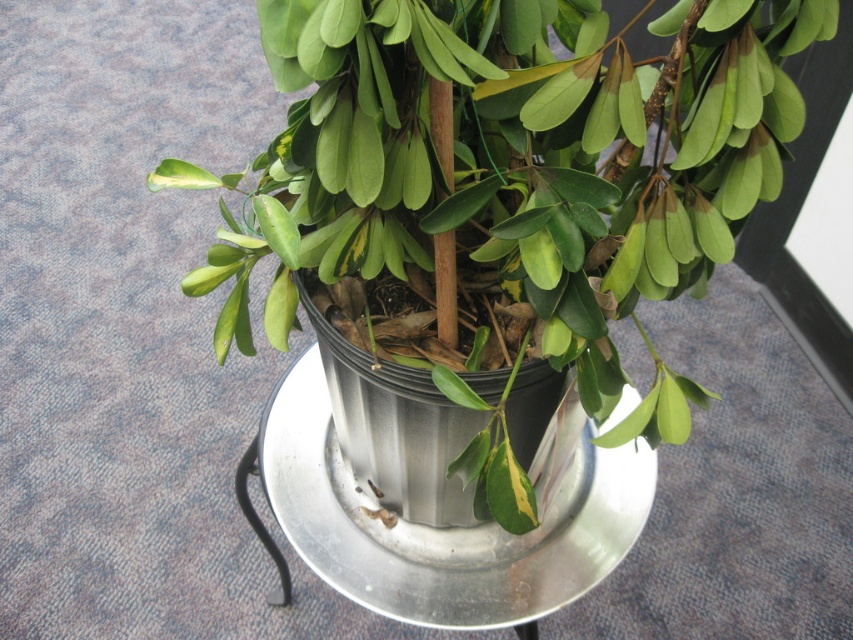
Who is positioned more to the left, green matte plant at center or green matte leaf at center?

From the viewer's perspective, green matte leaf at center appears more on the left side.

Measure the distance from green matte plant at center to green matte leaf at center.

green matte plant at center and green matte leaf at center are 8.77 inches apart.

This screenshot has height=640, width=853. Find the location of `green matte plant at center`. green matte plant at center is located at coordinates (498, 196).

Locate an element on the screen. The height and width of the screenshot is (640, 853). green matte plant at center is located at coordinates (498, 196).

Between point (730, 173) and point (445, 512), which one is positioned in front?

Point (730, 173)

I want to click on green matte plant at center, so click(498, 196).

The width and height of the screenshot is (853, 640). Find the location of `green matte plant at center`. green matte plant at center is located at coordinates (498, 196).

Between point (421, 477) and point (289, 154), which one is positioned behind?

The point (421, 477) is more distant.

This screenshot has width=853, height=640. Identify the location of metallic silver pot at center. (395, 426).

Locate an element on the screen. metallic silver pot at center is located at coordinates (395, 426).